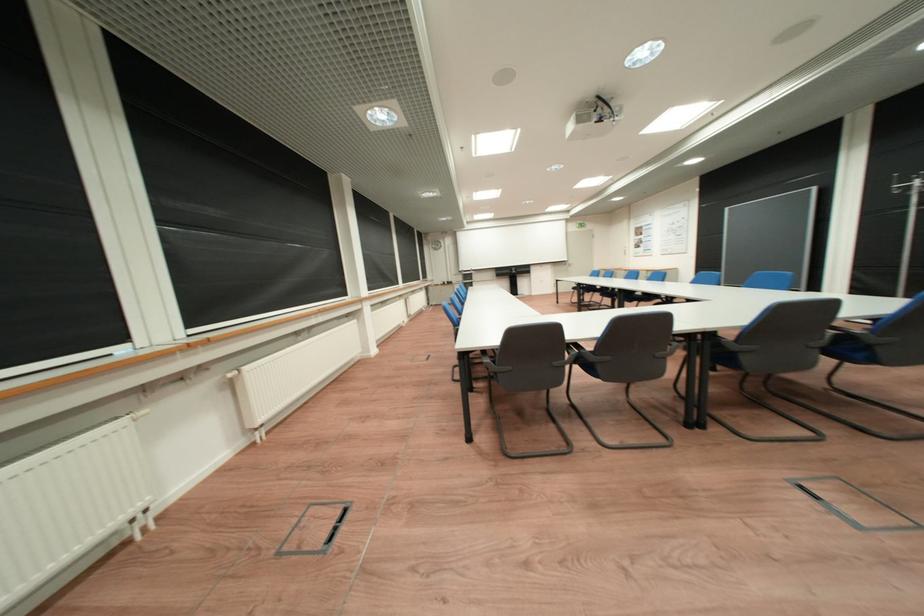
Image resolution: width=924 pixels, height=616 pixels. Describe the element at coordinates (140, 413) in the screenshot. I see `the white radiator valve` at that location.